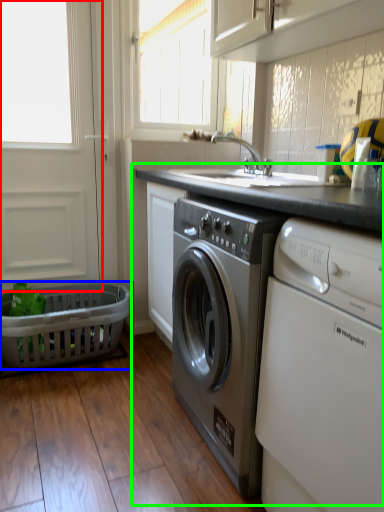
Question: Estimate the real-world distances between objects in this image. Which object is closer to screen door (highlighted by a red box), basket (highlighted by a blue box) or counter (highlighted by a green box)?

Choices:
 (A) basket
 (B) counter

Answer: (A)